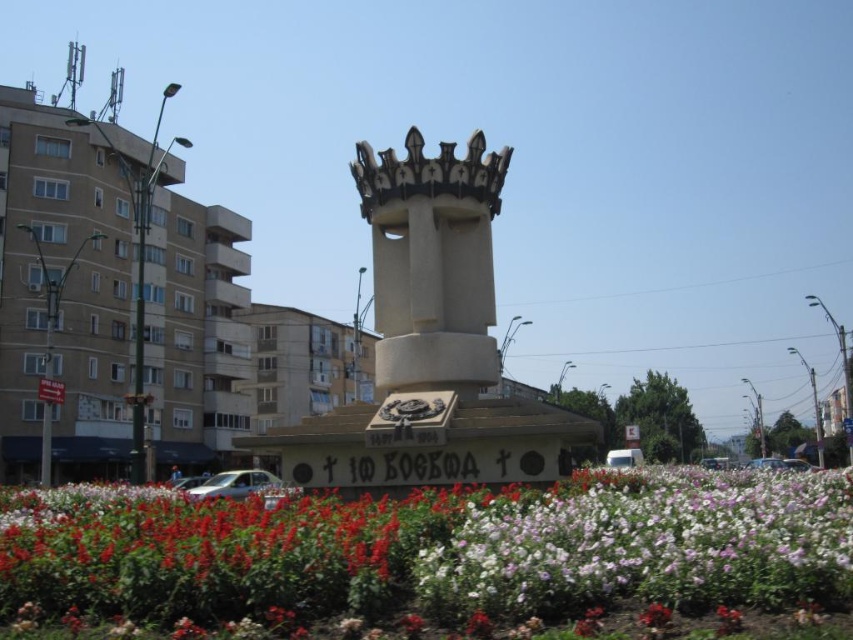
You are a photographer wanting to capture the monument in the background with both the white matte flowers at center and the white glossy car at center in the frame. Which object should you position closer to the camera to ensure both are visible without cropping?

The white glossy car at center should be positioned closer to the camera since it is smaller in size than the white matte flowers at center. This way, both objects will appear proportionally sized in the photo.

From the picture: You are a city planner designing a new public space and want to ensure accessibility. The monument area has a white matte flowers at center and a white stone tower at center. Which object would require more space to accommodate visitors around it?

The white matte flowers at center is larger in size than the white stone tower at center, so it would require more space to accommodate visitors around it.